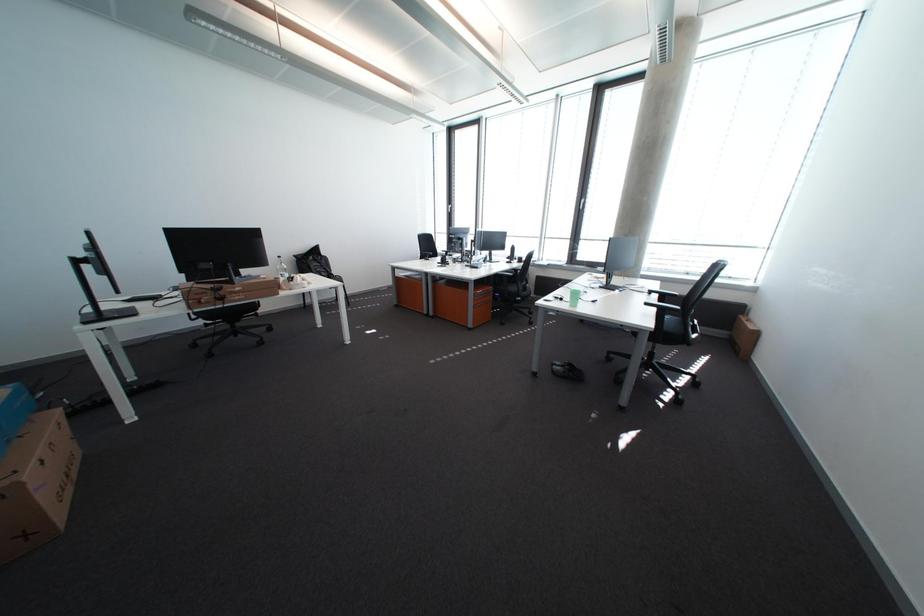
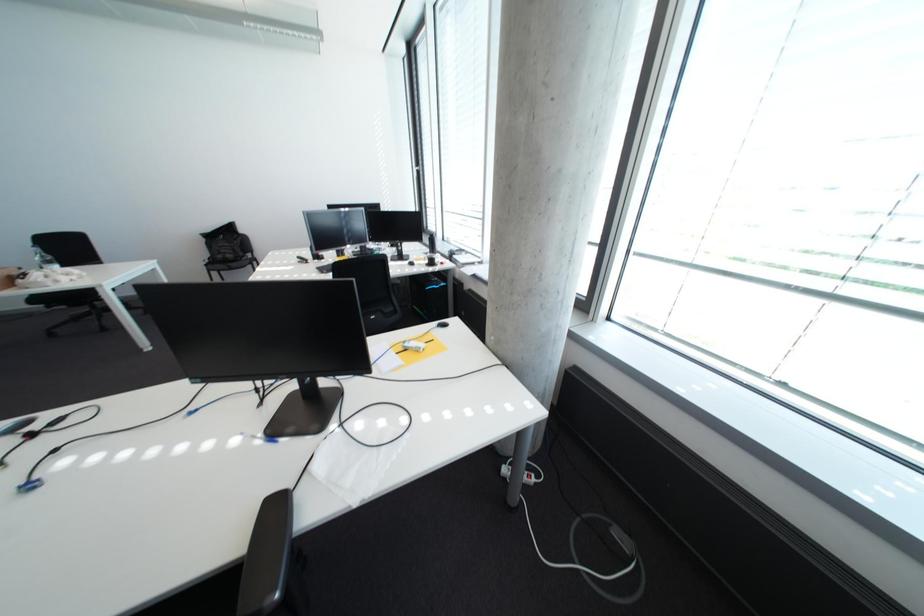
Which direction would the cameraman need to move to produce the second image?

The movement direction of the cameraman is right, forward.